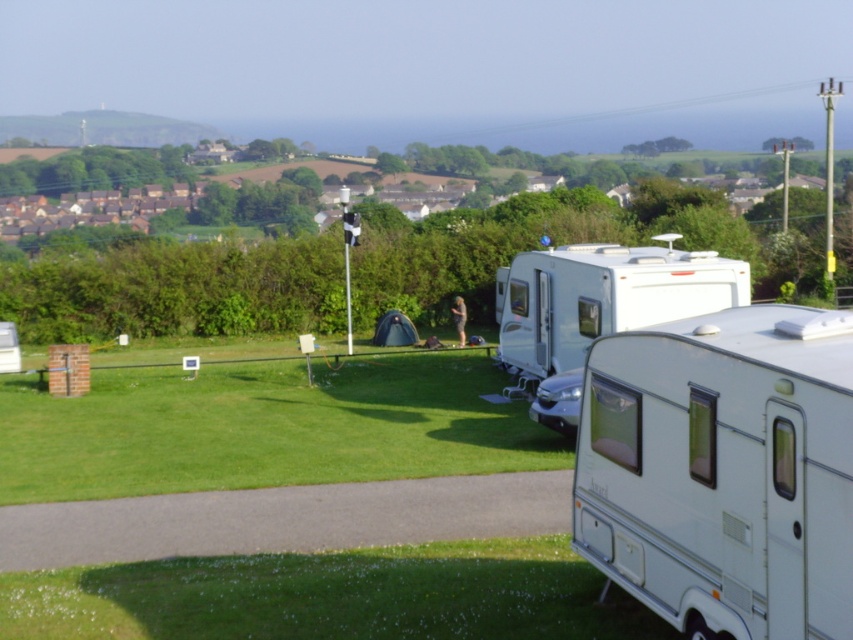
You are planning to drive a narrow truck through the pathway between the white glossy camper at center and the white glossy caravan at center. Based on the scene, can the truck pass through the pathway without touching either vehicle?

The white glossy camper at center is thinner than the white glossy caravan at center, so the pathway between them may have enough space for a narrow truck to pass through. However, the exact width of the pathway isn

You are planning to set up a picnic table between the two white vehicles in the scene. Which vehicle should you place the picnic table closer to if you want it to be positioned to the right of the white glossy camper at center but still to the left of the white glossy caravan at center?

The picnic table should be placed between the white glossy camper at center and the white glossy caravan at center, positioned to the right of the white glossy camper at center and to the left of the white glossy caravan at center. Since the white glossy camper at center is to the left of the white glossy caravan at center, placing it in this position ensures it is between them.

You are planning to set up a picnic table between the white glossy camper at center and the white glossy caravan at center. Based on their positions, which one should the picnic table be placed closer to in order to stay under the caravan?

The picnic table should be placed closer to the white glossy camper at center because it is positioned under the white glossy caravan at center, so placing it near the camper would keep it under the caravan.